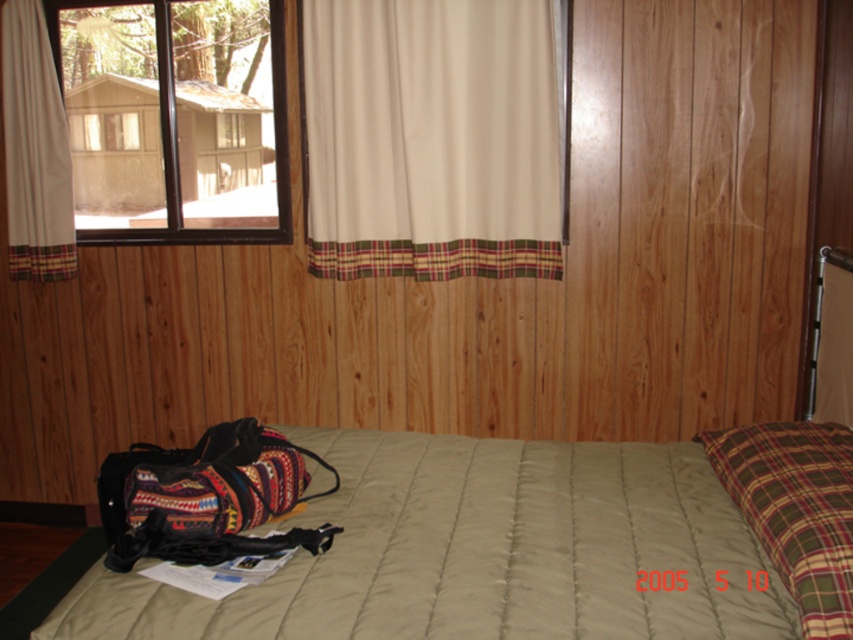
Which is below, clear glass window at upper left or multicolored woven duffel at lower left?

multicolored woven duffel at lower left

Is clear glass window at upper left below multicolored woven duffel at lower left?

Actually, clear glass window at upper left is above multicolored woven duffel at lower left.

What do you see at coordinates (173, 118) in the screenshot?
I see `clear glass window at upper left` at bounding box center [173, 118].

The image size is (853, 640). What are the coordinates of `clear glass window at upper left` in the screenshot? It's located at (173, 118).

Where is `clear glass window at upper left`? clear glass window at upper left is located at coordinates (173, 118).

Is clear glass window at upper left thinner than white fabric curtain at upper left?

No, clear glass window at upper left is not thinner than white fabric curtain at upper left.

Is point (84, 156) positioned in front of point (49, 176)?

No.

Locate an element on the screen. The image size is (853, 640). clear glass window at upper left is located at coordinates (173, 118).

Does multicolored woven duffel at lower left appear under white fabric curtain at upper left?

Indeed, multicolored woven duffel at lower left is positioned under white fabric curtain at upper left.

Is point (200, 508) in front of point (10, 275)?

Yes, it is in front of point (10, 275).

The height and width of the screenshot is (640, 853). Identify the location of multicolored woven duffel at lower left. (206, 497).